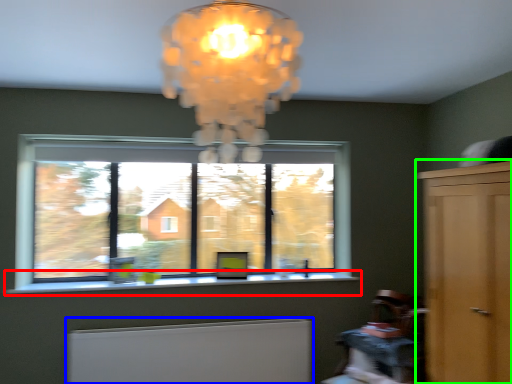
Question: Based on their relative distances, which object is farther from window sill (highlighted by a red box)? Choose from radiator (highlighted by a blue box) and dresser (highlighted by a green box).

Choices:
 (A) radiator
 (B) dresser

Answer: (B)